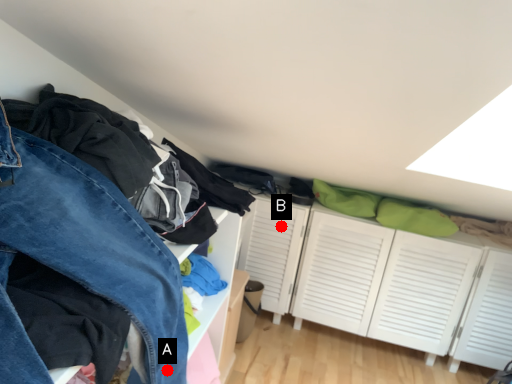
Question: Two points are circled on the image, labeled by A and B beside each circle. Which point is further to the camera?

Choices:
 (A) A is further
 (B) B is further

Answer: (B)